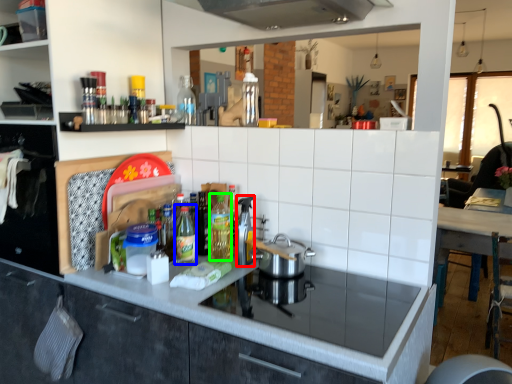
Question: Which is farther away from appliance (highlighted by a red box)? bottle (highlighted by a blue box) or bottle (highlighted by a green box)?

Choices:
 (A) bottle
 (B) bottle

Answer: (A)